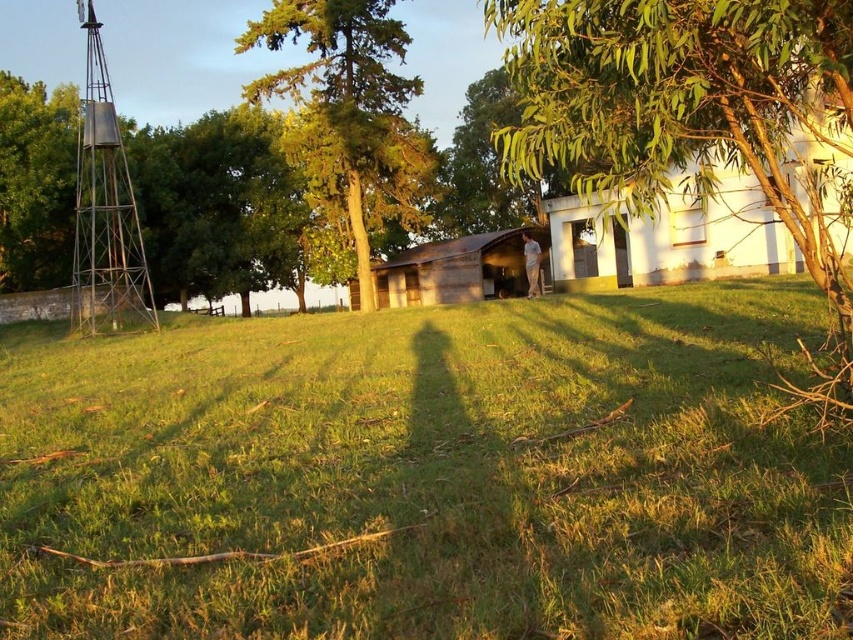
Locate an element on the screen. The height and width of the screenshot is (640, 853). metallic water tower at left is located at coordinates 105,211.

Between point (82, 109) and point (451, 157), which one is positioned in front?

Point (82, 109) is more forward.

The height and width of the screenshot is (640, 853). Find the location of `metallic water tower at left`. metallic water tower at left is located at coordinates point(105,211).

Is green grass at center wider than green leafy tree at upper center?

Correct, the width of green grass at center exceeds that of green leafy tree at upper center.

Does green grass at center have a greater height compared to green leafy tree at upper center?

Incorrect, green grass at center's height is not larger of green leafy tree at upper center's.

Who is more forward, (292, 355) or (479, 166)?

Point (292, 355)

Where is `green grass at center`? The height and width of the screenshot is (640, 853). green grass at center is located at coordinates (428, 474).

Where is `green textured tree at center`? The width and height of the screenshot is (853, 640). green textured tree at center is located at coordinates (349, 104).

Which is more to the left, green textured tree at center or metallic water tower at left?

metallic water tower at left

Between point (351, 3) and point (123, 256), which one is positioned behind?

Positioned behind is point (351, 3).

Locate an element on the screen. The image size is (853, 640). green textured tree at center is located at coordinates (349, 104).